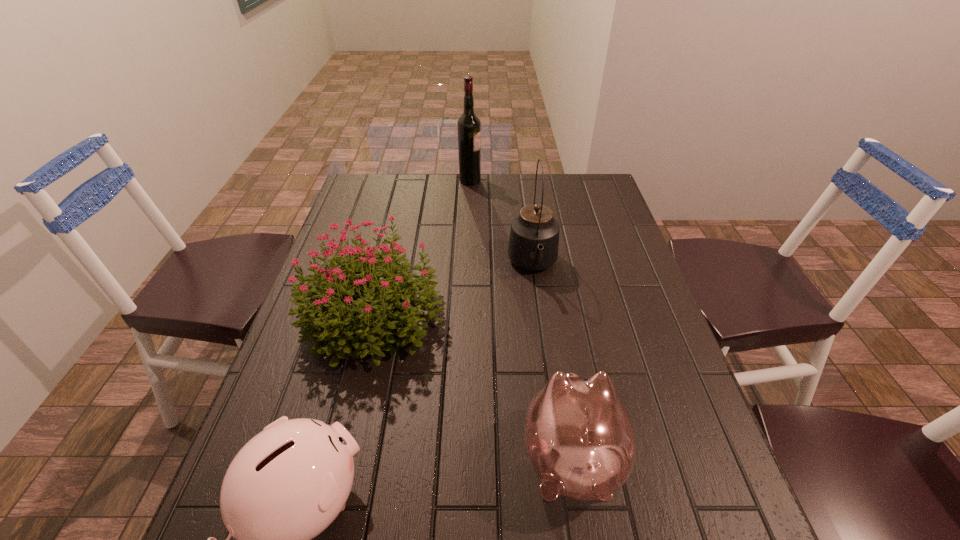
At what (x,y) coordinates should I click in order to perform the action: click on vacant area situated on the front facing side of the right piggy bank. Please return your answer as a coordinate pair (x, y). Looking at the image, I should click on (553, 343).

Locate an element on the screen. The image size is (960, 540). object that is at the far edge is located at coordinates (468, 125).

Where is `object present at the left edge`? The width and height of the screenshot is (960, 540). object present at the left edge is located at coordinates (322, 310).

This screenshot has height=540, width=960. I want to click on free space at the far edge of the desktop, so click(502, 178).

Where is `free space at the left edge`? The width and height of the screenshot is (960, 540). free space at the left edge is located at coordinates (326, 417).

Image resolution: width=960 pixels, height=540 pixels. Find the location of `vacant position at the right edge of the desktop`. vacant position at the right edge of the desktop is located at coordinates (677, 434).

Locate an element on the screen. This screenshot has width=960, height=540. vacant space at the far left corner of the desktop is located at coordinates (385, 198).

In the image, there is a desktop. Where is `vacant space at the far right corner`? The height and width of the screenshot is (540, 960). vacant space at the far right corner is located at coordinates (588, 182).

Find the location of a particular element. Image resolution: width=960 pixels, height=540 pixels. vacant region between the wine bottle and the bouquet is located at coordinates (421, 247).

Where is `empty location between the right piggy bank and the bouquet`? empty location between the right piggy bank and the bouquet is located at coordinates (472, 386).